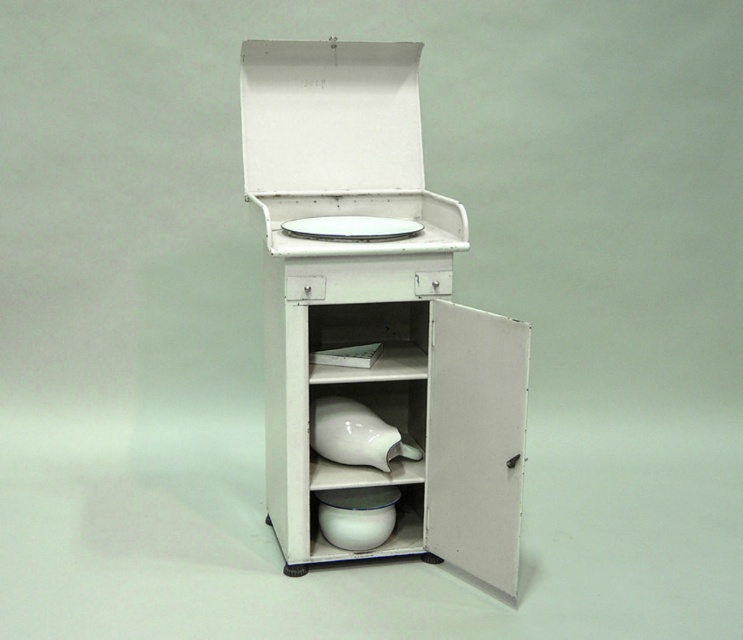
Describe the element at coordinates (354, 435) in the screenshot. The width and height of the screenshot is (743, 640). I see `white glossy vase at center` at that location.

Does white glossy vase at center have a greater height compared to white glossy plate at upper center?

Yes, white glossy vase at center is taller than white glossy plate at upper center.

The height and width of the screenshot is (640, 743). What do you see at coordinates (354, 435) in the screenshot?
I see `white glossy vase at center` at bounding box center [354, 435].

The image size is (743, 640). Identify the location of white glossy vase at center. (354, 435).